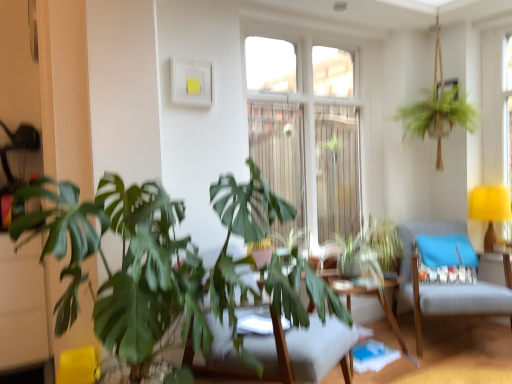
Question: From a real-world perspective, is blue fabric pillow at right under wooden swivel chair at center, which appears as the 1th swivel chair when viewed from the front?

Choices:
 (A) no
 (B) yes

Answer: (A)

Question: Is blue fabric pillow at right aimed at wooden swivel chair at center, which appears as the 1th swivel chair when viewed from the front?

Choices:
 (A) no
 (B) yes

Answer: (A)

Question: Does blue fabric pillow at right have a lesser height compared to wooden swivel chair at center, marked as the 2th swivel chair in a right-to-left arrangement?

Choices:
 (A) no
 (B) yes

Answer: (B)

Question: Is wooden swivel chair at center, which is the second swivel chair in back-to-front order, located within blue fabric pillow at right?

Choices:
 (A) no
 (B) yes

Answer: (A)

Question: Is blue fabric pillow at right smaller than wooden swivel chair at center, marked as the 2th swivel chair in a right-to-left arrangement?

Choices:
 (A) no
 (B) yes

Answer: (B)

Question: Is point (292, 360) positioned closer to the camera than point (417, 365)?

Choices:
 (A) farther
 (B) closer

Answer: (B)

Question: From their relative heights in the image, would you say wooden swivel chair at center, acting as the 1th swivel chair starting from the left, is taller or shorter than wooden table at center?

Choices:
 (A) short
 (B) tall

Answer: (B)

Question: Looking at the image, does wooden swivel chair at center, which is the second swivel chair in back-to-front order, seem bigger or smaller compared to wooden table at center?

Choices:
 (A) small
 (B) big

Answer: (B)

Question: In the image, is wooden swivel chair at center, acting as the 1th swivel chair starting from the left, positioned in front of or behind wooden table at center?

Choices:
 (A) front
 (B) behind

Answer: (A)

Question: Considering the positions of wooden table at center and clear glass window at center in the image, is wooden table at center bigger or smaller than clear glass window at center?

Choices:
 (A) big
 (B) small

Answer: (B)

Question: From the image's perspective, is wooden table at center positioned above or below clear glass window at center?

Choices:
 (A) below
 (B) above

Answer: (A)

Question: From their relative heights in the image, would you say wooden table at center is taller or shorter than clear glass window at center?

Choices:
 (A) tall
 (B) short

Answer: (B)

Question: From a real-world perspective, is wooden table at center positioned above or below clear glass window at center?

Choices:
 (A) above
 (B) below

Answer: (B)

Question: From a real-world perspective, is clear glass window at center positioned above or below green leafy plant at center?

Choices:
 (A) below
 (B) above

Answer: (B)

Question: Is clear glass window at center situated inside green leafy plant at center or outside?

Choices:
 (A) inside
 (B) outside

Answer: (B)